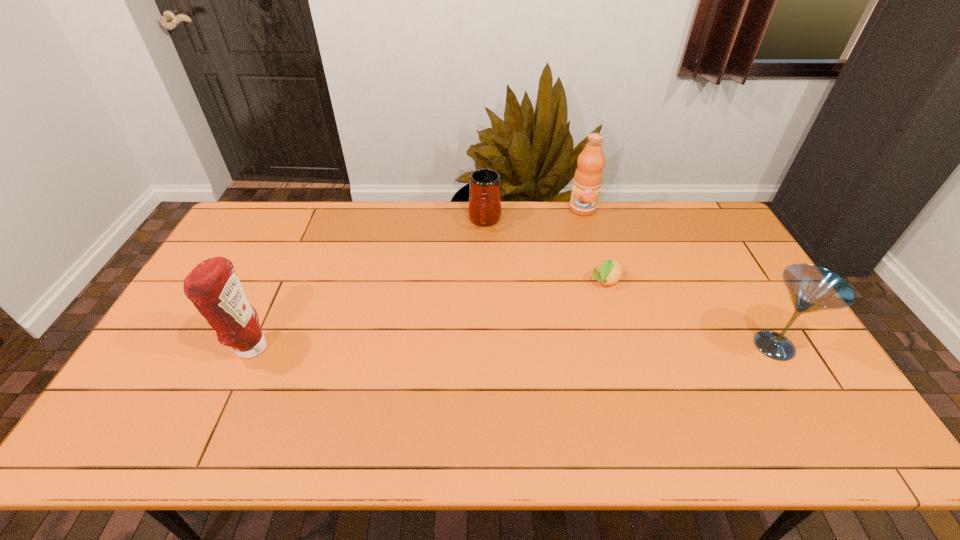
Identify the location of free space located 0.060m with leaves positioned above the shortest object. Image resolution: width=960 pixels, height=540 pixels. (592, 303).

At what (x,y) coordinates should I click in order to perform the action: click on free space located with leaves positioned above the shortest object. Please return your answer as a coordinate pair (x, y). This screenshot has height=540, width=960. Looking at the image, I should click on (588, 309).

At what (x,y) coordinates should I click in order to perform the action: click on vacant point located 0.290m with leaves positioned above the shortest object. Please return your answer as a coordinate pair (x, y). Image resolution: width=960 pixels, height=540 pixels. Looking at the image, I should click on (559, 356).

You are a GUI agent. You are given a task and a screenshot of the screen. Output one action in this format:
    pyautogui.click(x=<x>, y=<y>)
    Task: Click on the free space located 0.200m on the label side of the fruit juice
    
    Given the screenshot: What is the action you would take?
    pyautogui.click(x=582, y=252)

Find the location of a particular element. The image size is (960, 540). free space located on the label side of the fruit juice is located at coordinates (581, 285).

Find the location of a particular element. free space located on the label side of the fruit juice is located at coordinates [x=581, y=272].

At what (x,y) coordinates should I click in order to perform the action: click on free space located 0.210m on the side of the second shortest object with the handle. Please return your answer as a coordinate pair (x, y). The image size is (960, 540). Looking at the image, I should click on (479, 276).

This screenshot has height=540, width=960. Identify the location of vacant space situated on the side of the second shortest object with the handle. (478, 288).

The width and height of the screenshot is (960, 540). In order to click on vacant space positioned 0.340m on the side of the second shortest object with the handle in this screenshot , I will do `click(476, 307)`.

I want to click on fruit juice located at the far edge, so click(x=588, y=176).